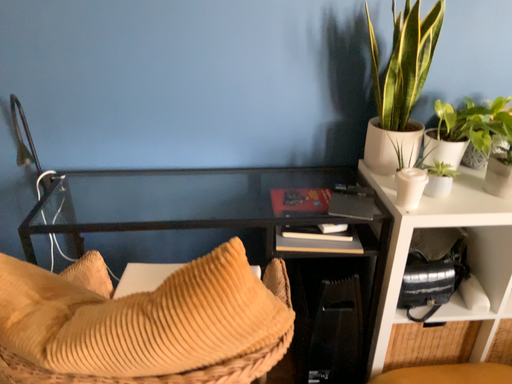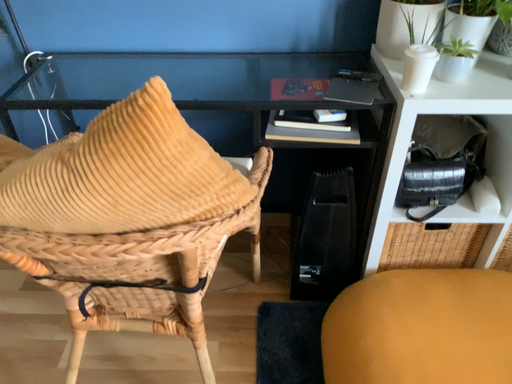
Question: How did the camera likely rotate when shooting the video?

Choices:
 (A) rotated upward
 (B) rotated downward

Answer: (B)